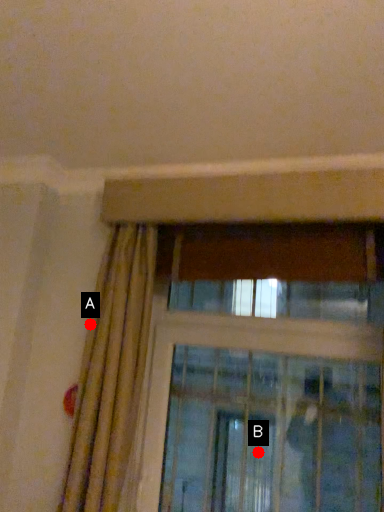
Question: Two points are circled on the image, labeled by A and B beside each circle. Which point is closer to the camera taking this photo?

Choices:
 (A) A is closer
 (B) B is closer

Answer: (A)